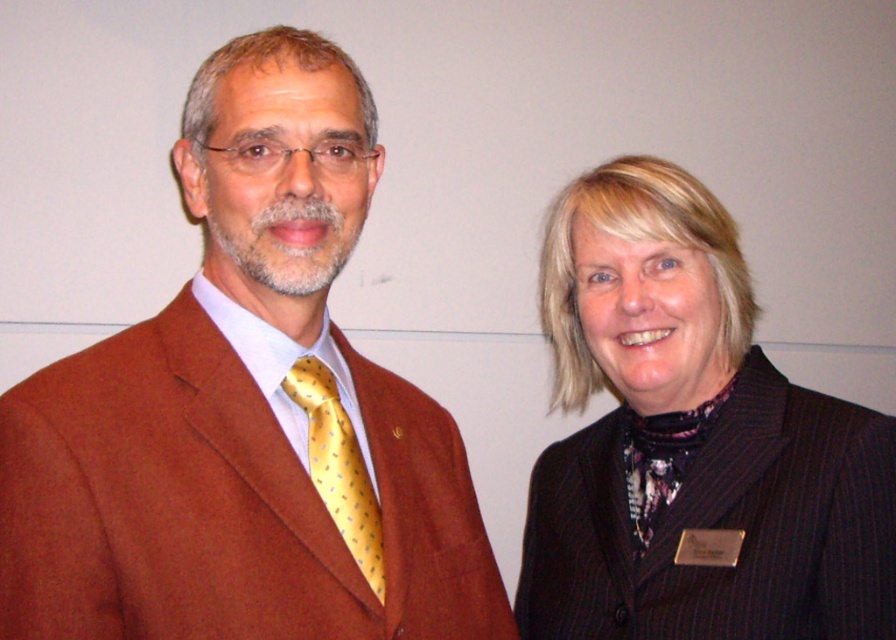
Question: Estimate the real-world distances between objects in this image. Which object is farther from the yellow dotted silk tie at left?

Choices:
 (A) black pinstripe blazer at right
 (B) brown woolen suit at left

Answer: (A)

Question: Which is farther from the brown woolen suit at left?

Choices:
 (A) yellow dotted silk tie at left
 (B) black pinstripe blazer at right

Answer: (B)

Question: Does black pinstripe blazer at right have a greater width compared to yellow dotted silk tie at left?

Choices:
 (A) no
 (B) yes

Answer: (B)

Question: In this image, where is brown woolen suit at left located relative to yellow dotted silk tie at left?

Choices:
 (A) above
 (B) below

Answer: (A)

Question: Which object appears closest to the camera in this image?

Choices:
 (A) brown woolen suit at left
 (B) yellow dotted silk tie at left

Answer: (A)

Question: Can you confirm if black pinstripe blazer at right is positioned to the left of yellow dotted silk tie at left?

Choices:
 (A) yes
 (B) no

Answer: (B)